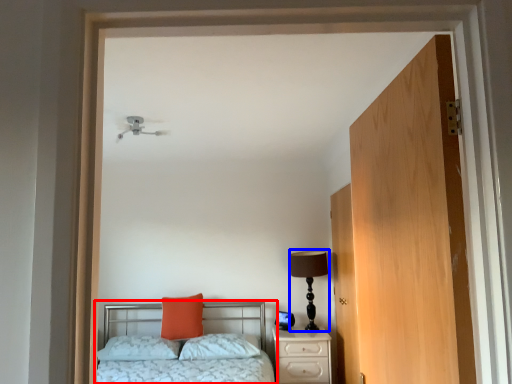
Question: Which point is closer to the camera, bed (highlighted by a red box) or table lamp (highlighted by a blue box)?

Choices:
 (A) bed
 (B) table lamp

Answer: (A)